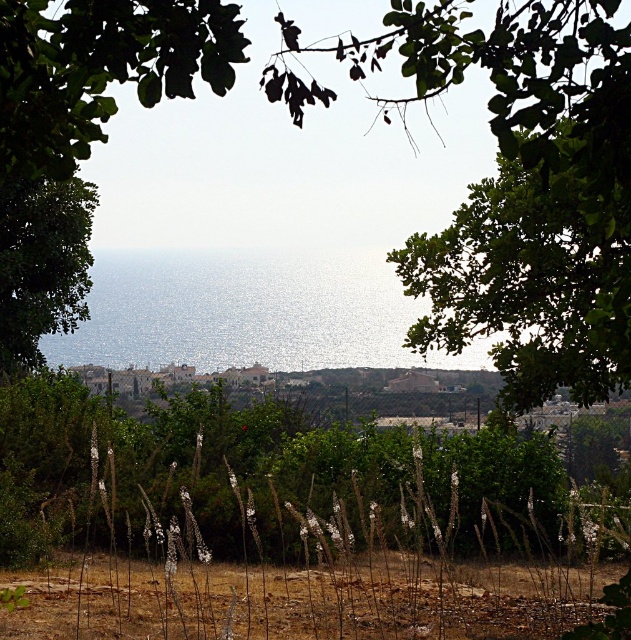
You are standing at the viewpoint of the image and want to walk towards the point with coordinates point (9, 289). However, there is an obstacle at point (481, 250). Will you encounter this obstacle before reaching your destination?

Yes, you will encounter the obstacle at point (481, 250) before reaching point (9, 289) because point (481, 250) is in front of point (9, 289) according to the spatial arrangement in the scene.